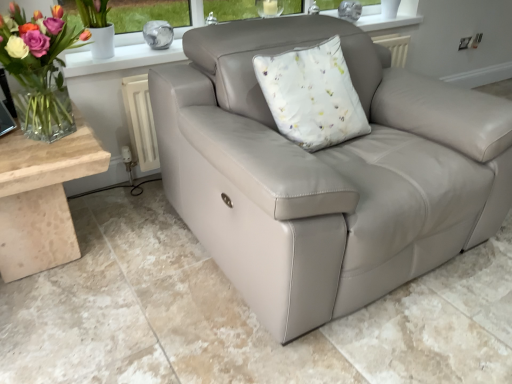
What is the approximate height of matte leather couch at center?

3.29 inches.

Where is `clear glass vase at left`? clear glass vase at left is located at coordinates (40, 69).

Does clear glass vase at left turn towards beige marble table at lower left?

No, clear glass vase at left is not facing towards beige marble table at lower left.

Can you confirm if clear glass vase at left is smaller than beige marble table at lower left?

Yes.

This screenshot has height=384, width=512. I want to click on table behind the clear glass vase at left, so click(42, 198).

Is clear glass vase at left with beige marble table at lower left?

No, clear glass vase at left is not with beige marble table at lower left.

In the scene shown: From the image's perspective, between beige marble table at lower left and clear glass vase at left, who is located below?

beige marble table at lower left is shown below in the image.

Is beige marble table at lower left not near clear glass vase at left?

No, beige marble table at lower left is in close proximity to clear glass vase at left.

Is clear glass vase at left at the back of beige marble table at lower left?

No, beige marble table at lower left is not facing the opposite direction of clear glass vase at left.

Between beige marble table at lower left and clear glass vase at left, which one has smaller width?

clear glass vase at left.

From the image's perspective, is clear glass vase at left on top of matte leather couch at center?

Yes, from the image's perspective, clear glass vase at left is above matte leather couch at center.

How much distance is there between clear glass vase at left and matte leather couch at center?

They are 76.40 centimeters apart.

Who is smaller, clear glass vase at left or matte leather couch at center?

clear glass vase at left.

The width and height of the screenshot is (512, 384). Identify the location of floral arrangement that appears behind the matte leather couch at center. (40, 69).

Which is in front, point (286, 152) or point (35, 155)?

The point (286, 152) is closer to the camera.

From the image's perspective, which one is positioned higher, matte leather couch at center or beige marble table at lower left?

matte leather couch at center appears higher in the image.

Is beige marble table at lower left completely or partially inside matte leather couch at center?

No, beige marble table at lower left is not a part of matte leather couch at center.

Considering the sizes of objects matte leather couch at center and beige marble table at lower left in the image provided, who is taller, matte leather couch at center or beige marble table at lower left?

beige marble table at lower left.

Could you tell me if matte leather couch at center is facing clear glass vase at left?

No, matte leather couch at center is not facing towards clear glass vase at left.

Is matte leather couch at center to the left of clear glass vase at left from the viewer's perspective?

No.

I want to click on studio couch beneath the clear glass vase at left (from a real-world perspective), so click(x=325, y=173).

Can you confirm if beige marble table at lower left is bigger than matte leather couch at center?

Incorrect, beige marble table at lower left is not larger than matte leather couch at center.

Does beige marble table at lower left turn towards matte leather couch at center?

No, beige marble table at lower left is not oriented towards matte leather couch at center.

Which is more to the right, beige marble table at lower left or matte leather couch at center?

matte leather couch at center is more to the right.

From a real-world perspective, is beige marble table at lower left below matte leather couch at center?

Incorrect, from a real-world perspective, beige marble table at lower left is higher than matte leather couch at center.

The image size is (512, 384). Find the location of `table on the left of clear glass vase at left`. table on the left of clear glass vase at left is located at coordinates (42, 198).

Locate an element on the screen. Image resolution: width=512 pixels, height=384 pixels. table below the clear glass vase at left (from a real-world perspective) is located at coordinates (42, 198).

Based on the photo, when comparing their distances from matte leather couch at center, does clear glass vase at left or beige marble table at lower left seem further?

The object further to matte leather couch at center is clear glass vase at left.

Looking at the image, which one is located further to beige marble table at lower left, clear glass vase at left or matte leather couch at center?

matte leather couch at center.

Estimate the real-world distances between objects in this image. Which object is further from clear glass vase at left, beige marble table at lower left or matte leather couch at center?

The object further to clear glass vase at left is matte leather couch at center.

Based on the photo, looking at the image, which one is located closer to beige marble table at lower left, matte leather couch at center or clear glass vase at left?

clear glass vase at left is positioned closer to the anchor beige marble table at lower left.

Based on their spatial positions, is matte leather couch at center or beige marble table at lower left further from clear glass vase at left?

matte leather couch at center lies further to clear glass vase at left than the other object.

From the image, which object appears to be nearer to matte leather couch at center, beige marble table at lower left or clear glass vase at left?

beige marble table at lower left lies closer to matte leather couch at center than the other object.

This screenshot has height=384, width=512. In order to click on floral arrangement located between beige marble table at lower left and matte leather couch at center in the left-right direction in this screenshot , I will do `click(40, 69)`.